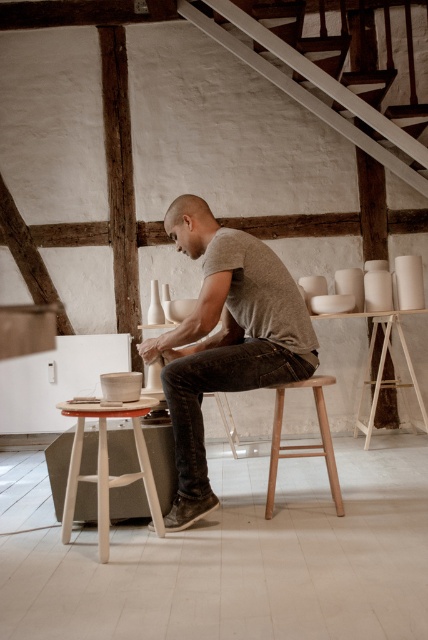
Question: Is gray matte t-shirt at center below white wood stool at center?

Choices:
 (A) no
 (B) yes

Answer: (A)

Question: Is gray matte t-shirt at center smaller than white wood stool at center?

Choices:
 (A) yes
 (B) no

Answer: (B)

Question: Among these objects, which one is nearest to the camera?

Choices:
 (A) white wood stool at center
 (B) gray matte t-shirt at center

Answer: (A)

Question: Observing the image, what is the correct spatial positioning of gray matte t-shirt at center in reference to white wood stool at center?

Choices:
 (A) below
 (B) above

Answer: (B)

Question: Estimate the real-world distances between objects in this image. Which object is closer to the gray matte t-shirt at center?

Choices:
 (A) white wood stool at center
 (B) light brown wooden stool at center

Answer: (A)

Question: Estimate the real-world distances between objects in this image. Which object is closer to the light brown wooden stool at center?

Choices:
 (A) gray matte t-shirt at center
 (B) white wood stool at center

Answer: (A)